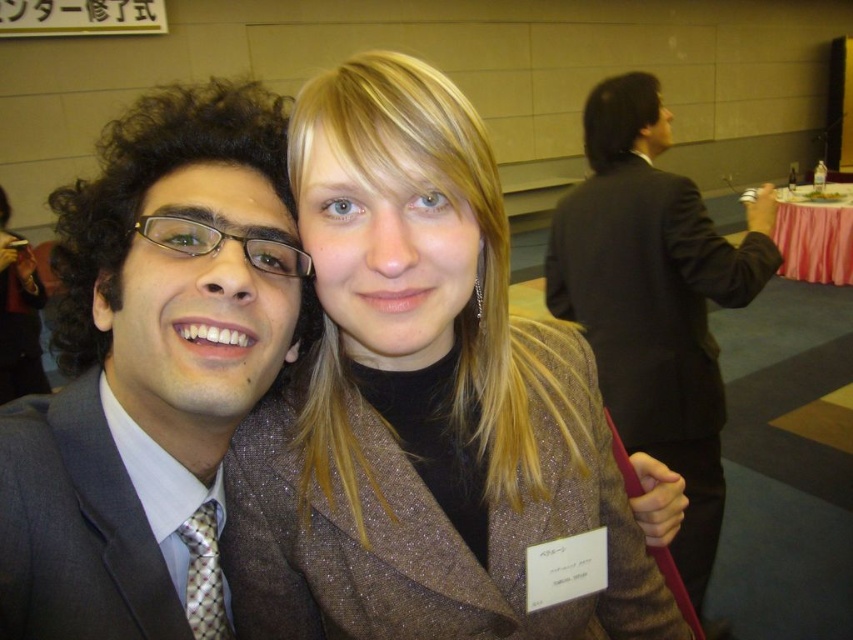
Question: Estimate the real-world distances between objects in this image. Which object is farther from the black suit at upper right?

Choices:
 (A) matte gray suit at left
 (B) shiny brown coat at center

Answer: (A)

Question: Which is nearer to the black suit at upper right?

Choices:
 (A) matte gray suit at left
 (B) shiny brown coat at center

Answer: (B)

Question: Is matte gray suit at left to the right of dark gray textured suit at left from the viewer's perspective?

Choices:
 (A) yes
 (B) no

Answer: (B)

Question: Does shiny brown coat at center appear on the left side of black suit at upper right?

Choices:
 (A) yes
 (B) no

Answer: (A)

Question: Does matte gray suit at left appear on the left side of black suit at upper right?

Choices:
 (A) yes
 (B) no

Answer: (A)

Question: Estimate the real-world distances between objects in this image. Which object is farther from the shiny brown coat at center?

Choices:
 (A) matte gray suit at left
 (B) dark gray textured suit at left

Answer: (B)